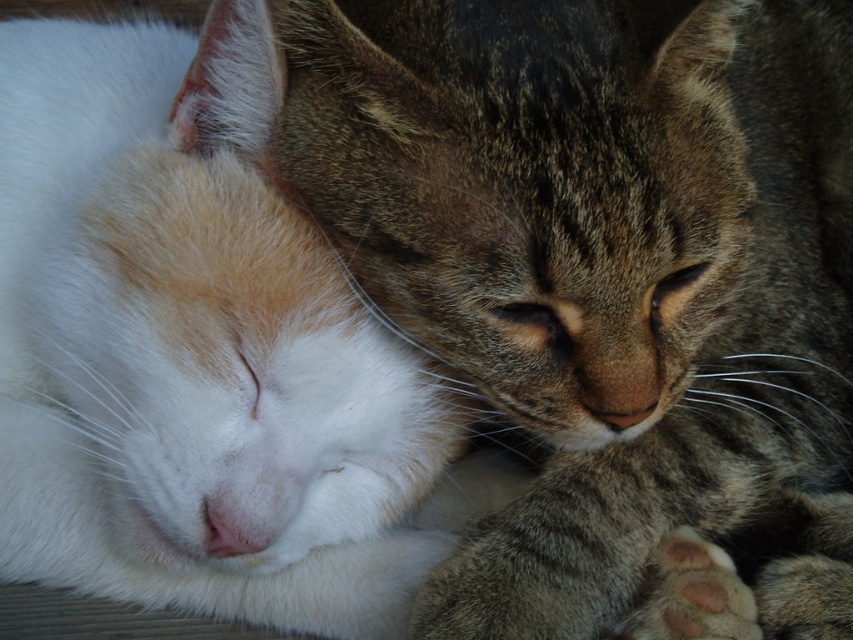
Question: Can you confirm if white soft fur cat at left is positioned above dark gray fur paw at lower right?

Choices:
 (A) yes
 (B) no

Answer: (A)

Question: Does tabby fur paw at center have a smaller size compared to white soft fur cat at left?

Choices:
 (A) yes
 (B) no

Answer: (A)

Question: Among these objects, which one is nearest to the camera?

Choices:
 (A) white soft fur cat at left
 (B) dark gray fur paw at lower right
 (C) tabby fur paw at center

Answer: (C)

Question: Can you confirm if white soft fur cat at left is wider than dark gray fur paw at lower right?

Choices:
 (A) no
 (B) yes

Answer: (B)

Question: Which point is farther to the camera?

Choices:
 (A) (735, 627)
 (B) (212, 595)

Answer: (B)

Question: Which object is positioned farthest from the white soft fur cat at left?

Choices:
 (A) dark gray fur paw at lower right
 (B) tabby fur paw at center

Answer: (A)